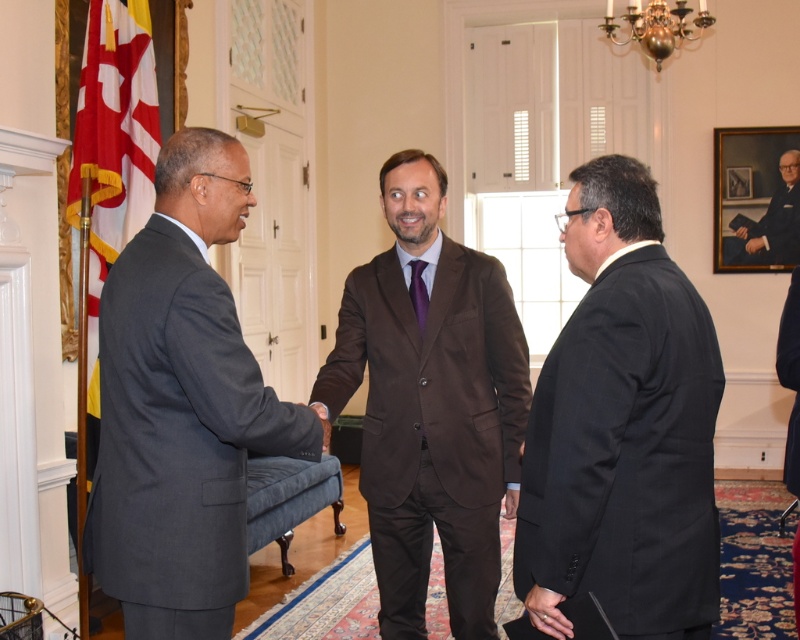
Between dark gray suit at left and purple satin tie at center, which one appears on the right side from the viewer's perspective?

From the viewer's perspective, purple satin tie at center appears more on the right side.

What do you see at coordinates (182, 406) in the screenshot? Image resolution: width=800 pixels, height=640 pixels. I see `dark gray suit at left` at bounding box center [182, 406].

Describe the element at coordinates (182, 406) in the screenshot. This screenshot has height=640, width=800. I see `dark gray suit at left` at that location.

Where is `dark gray suit at left`? The height and width of the screenshot is (640, 800). dark gray suit at left is located at coordinates (182, 406).

Does dark gray suit at left have a greater height compared to brown satin suit at center?

Incorrect, dark gray suit at left's height is not larger of brown satin suit at center's.

Is dark gray suit at left further to camera compared to brown satin suit at center?

No, dark gray suit at left is closer to the viewer.

Identify the location of dark gray suit at left. (182, 406).

Find the location of a particular element. dark gray suit at left is located at coordinates (182, 406).

Consider the image. How much distance is there between black matte suit at center and brown satin suit at center?

They are 30.64 inches apart.

Can you confirm if black matte suit at center is shorter than brown satin suit at center?

Correct, black matte suit at center is not as tall as brown satin suit at center.

Locate an element on the screen. black matte suit at center is located at coordinates (622, 428).